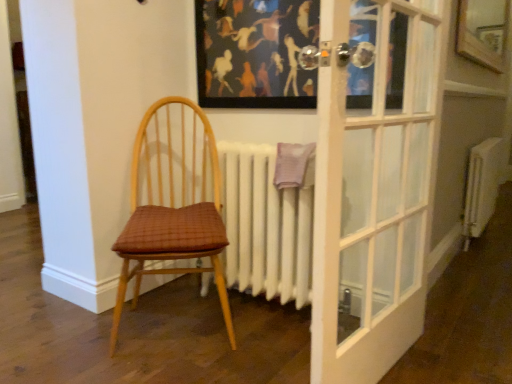
The height and width of the screenshot is (384, 512). What are the coordinates of `free point below white matte radiator at center, marked as the first radiator in a left-to-right arrangement (from a real-world perspective)` in the screenshot? It's located at (273, 315).